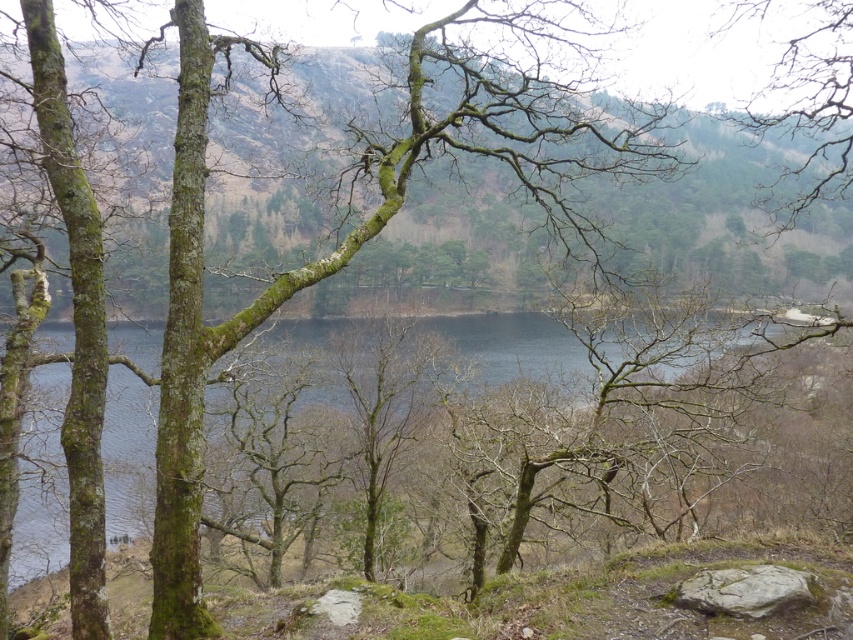
Does dark blue water at center appear over gray rough rock at lower right?

Indeed, dark blue water at center is positioned over gray rough rock at lower right.

Based on the photo, does dark blue water at center appear on the right side of gray rough rock at lower right?

No, dark blue water at center is not to the right of gray rough rock at lower right.

Image resolution: width=853 pixels, height=640 pixels. I want to click on dark blue water at center, so click(618, 445).